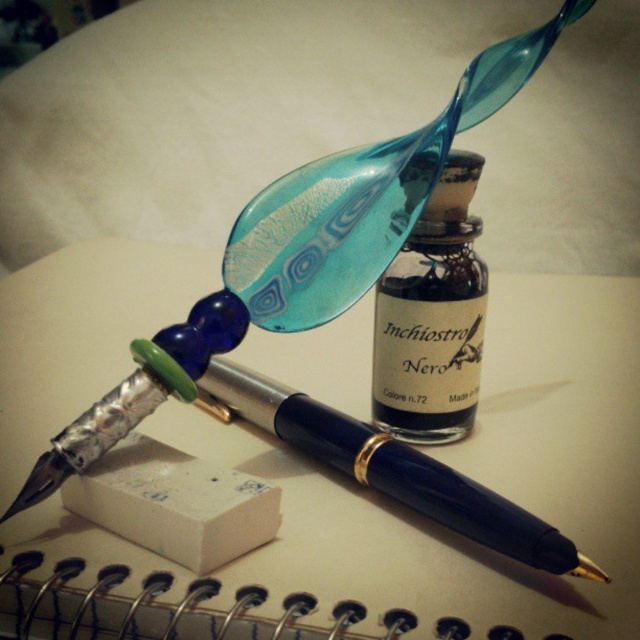
Question: Is spiral-bound paper at center to the right of navy blue metal pen at center from the viewer's perspective?

Choices:
 (A) yes
 (B) no

Answer: (B)

Question: Which point is farther to the camera?

Choices:
 (A) (156, 458)
 (B) (440, 508)

Answer: (A)

Question: Can you confirm if spiral-bound paper at center is positioned above white paper at center?

Choices:
 (A) yes
 (B) no

Answer: (A)

Question: Among these points, which one is farthest from the camera?

Choices:
 (A) (500, 506)
 (B) (93, 486)
 (C) (44, 428)
 (D) (465, 243)

Answer: (C)

Question: Is spiral-bound paper at center closer to the viewer compared to translucent glass ink bottle at center?

Choices:
 (A) no
 (B) yes

Answer: (B)

Question: Estimate the real-world distances between objects in this image. Which object is closer to the spiral-bound paper at center?

Choices:
 (A) navy blue metal pen at center
 (B) white paper at center

Answer: (A)